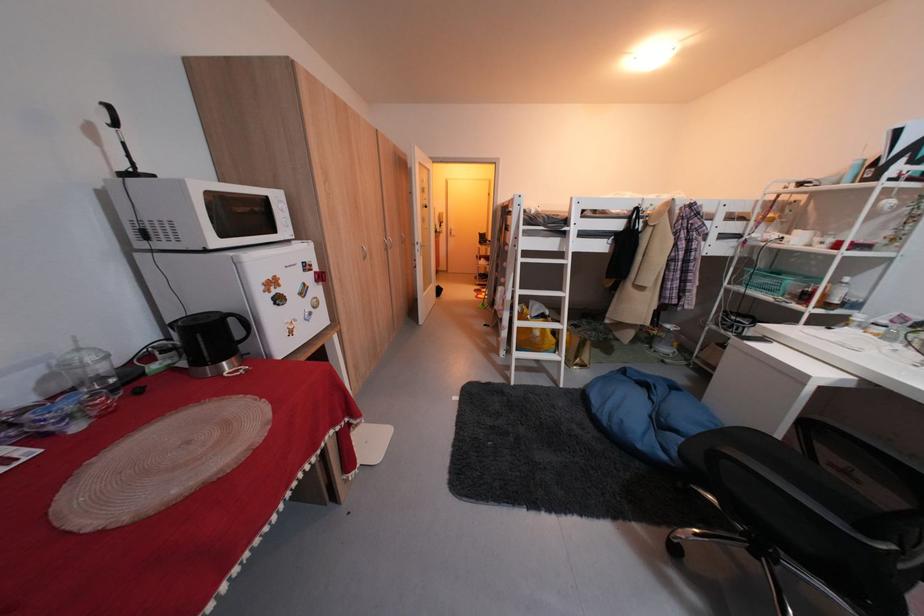
Locate an element on the screen. black kettle handle is located at coordinates point(239,325).